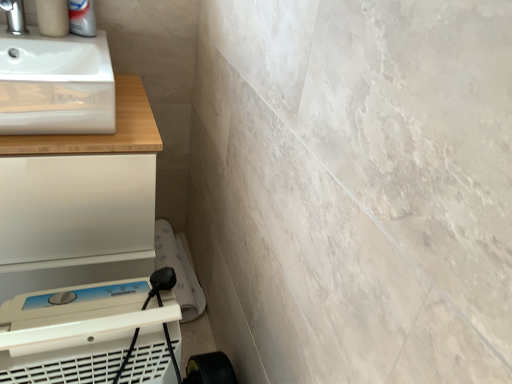
Question: Could satin nickel faucet at upper left be considered to be inside white matte counter at upper left?

Choices:
 (A) no
 (B) yes

Answer: (A)

Question: From a real-world perspective, is white matte counter at upper left located higher than satin nickel faucet at upper left?

Choices:
 (A) yes
 (B) no

Answer: (B)

Question: Is white matte counter at upper left looking in the opposite direction of satin nickel faucet at upper left?

Choices:
 (A) no
 (B) yes

Answer: (A)

Question: From the image's perspective, is white matte counter at upper left above satin nickel faucet at upper left?

Choices:
 (A) no
 (B) yes

Answer: (A)

Question: Are white matte counter at upper left and satin nickel faucet at upper left beside each other?

Choices:
 (A) no
 (B) yes

Answer: (A)

Question: Which is correct: white glossy sink at upper left is inside white matte counter at upper left, or outside of it?

Choices:
 (A) inside
 (B) outside

Answer: (B)

Question: Based on their sizes in the image, would you say white glossy sink at upper left is bigger or smaller than white matte counter at upper left?

Choices:
 (A) small
 (B) big

Answer: (A)

Question: From a real-world perspective, is white glossy sink at upper left positioned above or below white matte counter at upper left?

Choices:
 (A) below
 (B) above

Answer: (B)

Question: Is white glossy sink at upper left in front of or behind white matte counter at upper left in the image?

Choices:
 (A) behind
 (B) front

Answer: (B)

Question: Is white plastic air purifier at lower left bigger or smaller than satin nickel faucet at upper left?

Choices:
 (A) small
 (B) big

Answer: (B)

Question: Considering the positions of white plastic air purifier at lower left and satin nickel faucet at upper left in the image, is white plastic air purifier at lower left taller or shorter than satin nickel faucet at upper left?

Choices:
 (A) short
 (B) tall

Answer: (B)

Question: Considering the positions of point (33, 296) and point (25, 23), is point (33, 296) closer or farther from the camera than point (25, 23)?

Choices:
 (A) farther
 (B) closer

Answer: (B)

Question: Is white plastic air purifier at lower left spatially inside satin nickel faucet at upper left, or outside of it?

Choices:
 (A) inside
 (B) outside

Answer: (B)

Question: Is point (39, 145) positioned closer to the camera than point (10, 1)?

Choices:
 (A) closer
 (B) farther

Answer: (A)

Question: From the image's perspective, relative to satin nickel faucet at upper left, is white matte counter at upper left above or below?

Choices:
 (A) below
 (B) above

Answer: (A)